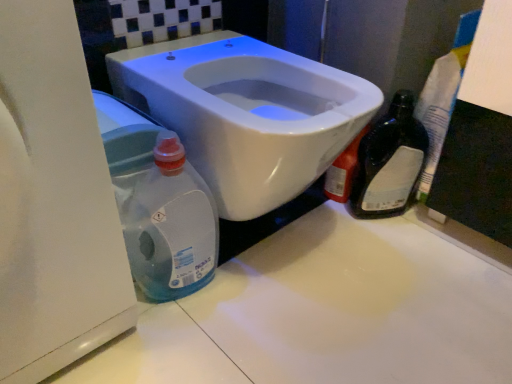
Describe the element at coordinates (162, 212) in the screenshot. The image size is (512, 384). I see `translucent plastic bottle at lower left` at that location.

The image size is (512, 384). Identify the location of white glossy counter top at center. (327, 313).

What are the coordinates of `black glass bottle at right` in the screenshot? It's located at (389, 162).

What is the approximate height of white glossy toilet at center?

It is 40.98 centimeters.

Identify the location of translucent plastic bottle at lower left. The width and height of the screenshot is (512, 384). (162, 212).

Is the position of black glass bottle at right less distant than that of white glossy counter top at center?

No, black glass bottle at right is behind white glossy counter top at center.

Does black glass bottle at right have a greater width compared to white glossy counter top at center?

Incorrect, the width of black glass bottle at right does not surpass that of white glossy counter top at center.

Is black glass bottle at right far from white glossy counter top at center?

That's not correct — black glass bottle at right is a little close to white glossy counter top at center.

Does point (382, 183) come closer to viewer compared to point (230, 295)?

No, (382, 183) is behind (230, 295).

Measure the distance between translucent plastic bottle at lower left and white glossy toilet at center.

translucent plastic bottle at lower left is 7.08 inches from white glossy toilet at center.

Does translucent plastic bottle at lower left turn towards white glossy toilet at center?

No.

Where is `toilet above the translucent plastic bottle at lower left (from the image's perspective)`? The height and width of the screenshot is (384, 512). toilet above the translucent plastic bottle at lower left (from the image's perspective) is located at coordinates (247, 113).

Which object is wider, translucent plastic bottle at lower left or white glossy toilet at center?

With larger width is white glossy toilet at center.

Is translucent plastic bottle at lower left aimed at white glossy counter top at center?

No, translucent plastic bottle at lower left does not turn towards white glossy counter top at center.

Are translucent plastic bottle at lower left and white glossy counter top at center located far from each other?

Actually, translucent plastic bottle at lower left and white glossy counter top at center are a little close together.

Considering the relative sizes of translucent plastic bottle at lower left and white glossy counter top at center in the image provided, is translucent plastic bottle at lower left bigger than white glossy counter top at center?

No.

From a real-world perspective, relative to black glass bottle at right, is white glossy toilet at center vertically above or below?

In terms of real-world spatial position, white glossy toilet at center is above black glass bottle at right.

The width and height of the screenshot is (512, 384). I want to click on bottle on the right of the white glossy toilet at center, so click(x=389, y=162).

Is white glossy toilet at center not within black glass bottle at right?

Yes, white glossy toilet at center is outside of black glass bottle at right.

Is white glossy counter top at center bigger than white glossy toilet at center?

No.

From the image's perspective, who appears lower, white glossy counter top at center or white glossy toilet at center?

white glossy counter top at center appears lower in the image.

Who is taller, white glossy counter top at center or white glossy toilet at center?

white glossy toilet at center.

Does white glossy counter top at center touch white glossy toilet at center?

They are not placed beside each other.

Are white glossy counter top at center and black glass bottle at right located far from each other?

Actually, white glossy counter top at center and black glass bottle at right are a little close together.

How distant is white glossy counter top at center from black glass bottle at right?

A distance of 11.55 inches exists between white glossy counter top at center and black glass bottle at right.

Is point (152, 376) positioned before point (381, 137)?

Yes, it is in front of point (381, 137).

Is white glossy counter top at center oriented towards black glass bottle at right?

No, white glossy counter top at center does not turn towards black glass bottle at right.

Is black glass bottle at right positioned before white glossy toilet at center?

No, black glass bottle at right is further to the viewer.

Is black glass bottle at right positioned far away from white glossy toilet at center?

No, black glass bottle at right is in close proximity to white glossy toilet at center.

How different are the orientations of black glass bottle at right and white glossy toilet at center in degrees?

The angle between the facing direction of black glass bottle at right and the facing direction of white glossy toilet at center is 34.9 degrees.

At what (x,y) coordinates should I click in order to perform the action: click on bottle that is above the white glossy counter top at center (from the image's perspective). Please return your answer as a coordinate pair (x, y). This screenshot has height=384, width=512. Looking at the image, I should click on (389, 162).

Find the location of a particular element. The width and height of the screenshot is (512, 384). toilet that appears on the right of translucent plastic bottle at lower left is located at coordinates click(247, 113).

From the image, which object appears to be nearer to black glass bottle at right, white glossy counter top at center or translucent plastic bottle at lower left?

white glossy counter top at center.

Looking at the image, which one is located further to white glossy toilet at center, black glass bottle at right or translucent plastic bottle at lower left?

black glass bottle at right lies further to white glossy toilet at center than the other object.

Estimate the real-world distances between objects in this image. Which object is further from white glossy toilet at center, translucent plastic bottle at lower left or white glossy counter top at center?

The object further to white glossy toilet at center is white glossy counter top at center.

Based on their spatial positions, is translucent plastic bottle at lower left or white glossy toilet at center closer to black glass bottle at right?

Among the two, white glossy toilet at center is located nearer to black glass bottle at right.

From the picture: Looking at the image, which one is located closer to black glass bottle at right, white glossy counter top at center or white glossy toilet at center?

Based on the image, white glossy counter top at center appears to be nearer to black glass bottle at right.

Considering their positions, is black glass bottle at right positioned closer to white glossy counter top at center than translucent plastic bottle at lower left?

translucent plastic bottle at lower left lies closer to white glossy counter top at center than the other object.

From the picture: Which object lies further to the anchor point translucent plastic bottle at lower left, black glass bottle at right or white glossy toilet at center?

black glass bottle at right is positioned further to the anchor translucent plastic bottle at lower left.

Estimate the real-world distances between objects in this image. Which object is closer to translucent plastic bottle at lower left, white glossy toilet at center or white glossy counter top at center?

white glossy toilet at center is closer to translucent plastic bottle at lower left.

Find the location of a particular element. toilet between translucent plastic bottle at lower left and black glass bottle at right from left to right is located at coordinates (247, 113).

The width and height of the screenshot is (512, 384). Find the location of `toilet positioned between white glossy counter top at center and black glass bottle at right from near to far`. toilet positioned between white glossy counter top at center and black glass bottle at right from near to far is located at coordinates (247, 113).

Locate an element on the screen. cleaning product located between white glossy counter top at center and black glass bottle at right in the depth direction is located at coordinates (162, 212).

This screenshot has width=512, height=384. Identify the location of cleaning product between white glossy toilet at center and white glossy counter top at center in the vertical direction. (162, 212).